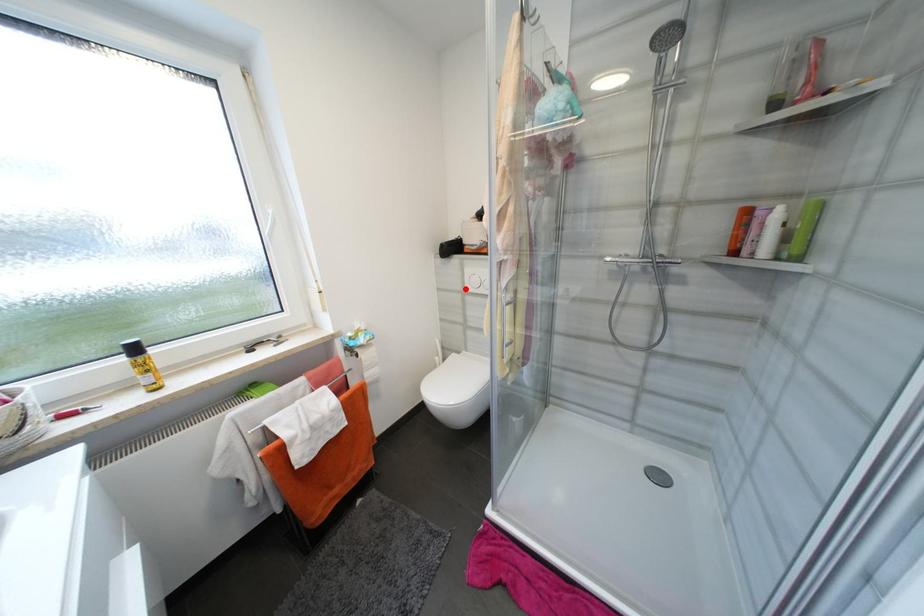
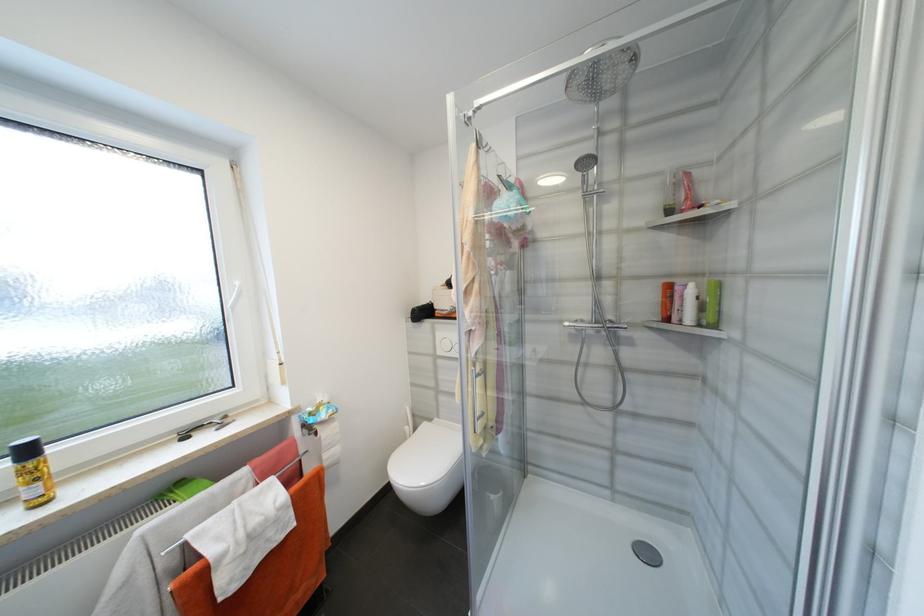
Where in the second image is the point corresponding to the highlighted location from the first image?

(436, 352)